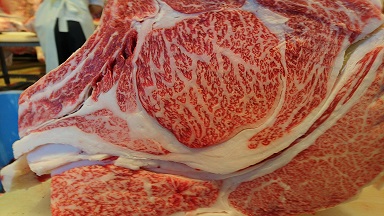
This screenshot has width=384, height=216. What are the coordinates of `table` in the screenshot? It's located at pos(24,205).